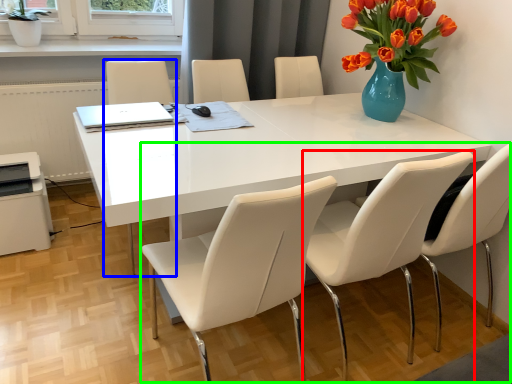
Question: Estimate the real-world distances between objects in this image. Which object is farther from chair (highlighted by a red box), armchair (highlighted by a blue box) or trio (highlighted by a green box)?

Choices:
 (A) armchair
 (B) trio

Answer: (A)